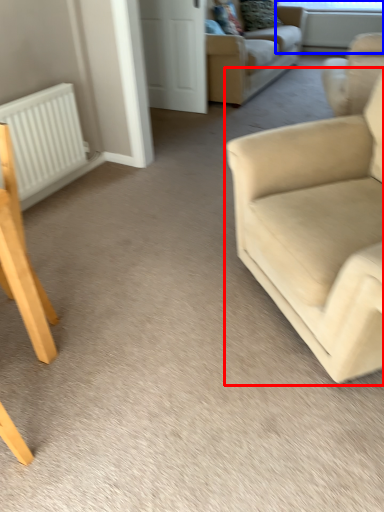
Question: Which of the following is the farthest to the observer, studio couch (highlighted by a red box) or window screen (highlighted by a blue box)?

Choices:
 (A) studio couch
 (B) window screen

Answer: (B)